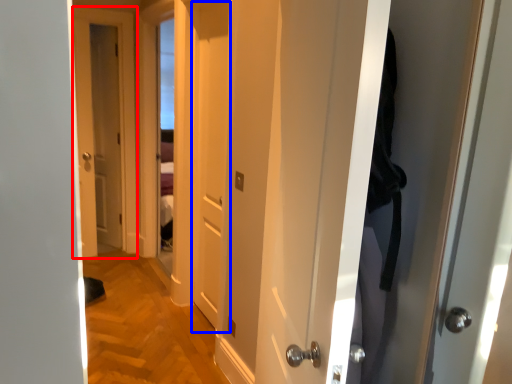
Question: Which of the following is the farthest to the observer, door (highlighted by a red box) or door (highlighted by a blue box)?

Choices:
 (A) door
 (B) door

Answer: (A)